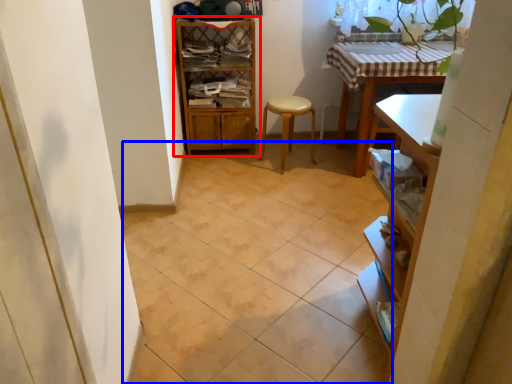
Question: Which point is closer to the camera, shelf (highlighted by a red box) or ceramic tile (highlighted by a blue box)?

Choices:
 (A) shelf
 (B) ceramic tile

Answer: (B)